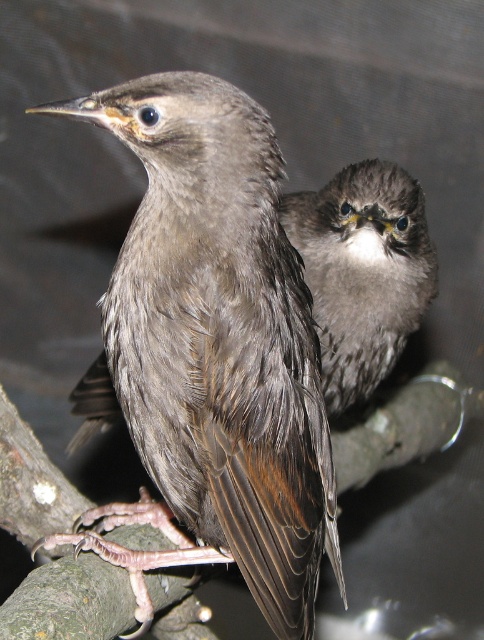
Is dark gray feathers at center taller than fuzzy gray bird at upper right?

No, dark gray feathers at center is not taller than fuzzy gray bird at upper right.

Measure the distance between point (363, 278) and camera.

Point (363, 278) is 1.64 meters away from camera.

The image size is (484, 640). I want to click on dark gray feathers at center, so click(x=363, y=272).

At what (x,y) coordinates should I click in order to perform the action: click on dark gray feathers at center. Please return your answer as a coordinate pair (x, y). The image size is (484, 640). Looking at the image, I should click on (363, 272).

Does brown feathered bird at center appear on the left side of dark gray feathers at center?

Indeed, brown feathered bird at center is positioned on the left side of dark gray feathers at center.

Does brown feathered bird at center have a greater width compared to dark gray feathers at center?

Indeed, brown feathered bird at center has a greater width compared to dark gray feathers at center.

Does point (212, 138) come behind point (334, 404)?

That is False.

Identify the location of brown feathered bird at center. (212, 352).

This screenshot has height=640, width=484. What do you see at coordinates (212, 352) in the screenshot?
I see `brown feathered bird at center` at bounding box center [212, 352].

Can you confirm if brown feathered bird at center is positioned below fuzzy gray bird at upper right?

Indeed, brown feathered bird at center is positioned under fuzzy gray bird at upper right.

Which is behind, point (314, 458) or point (326, 195)?

The point (326, 195) is behind.

Identify the location of brown feathered bird at center. The image size is (484, 640). (212, 352).